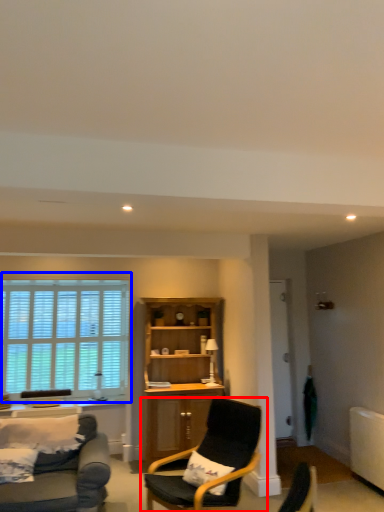
Question: Which object is closer to the camera taking this photo, chair (highlighted by a red box) or window (highlighted by a blue box)?

Choices:
 (A) chair
 (B) window

Answer: (A)